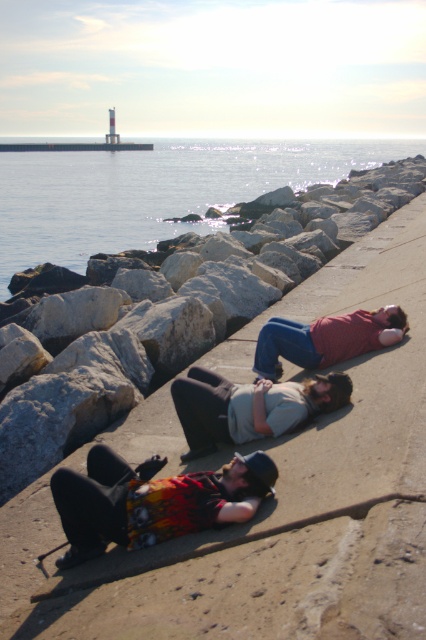
Question: Which object is the farthest from the printed cotton shirt at lower left?

Choices:
 (A) matte gray hoodie at center
 (B) clear water at center

Answer: (B)

Question: Can you confirm if matte gray hoodie at center is positioned above matte red shirt at center?

Choices:
 (A) no
 (B) yes

Answer: (A)

Question: Is printed cotton shirt at lower left below matte gray hoodie at center?

Choices:
 (A) yes
 (B) no

Answer: (A)

Question: Where is matte gray hoodie at center located in relation to matte red shirt at center in the image?

Choices:
 (A) left
 (B) right

Answer: (A)

Question: Considering the real-world distances, which object is farthest from the matte gray hoodie at center?

Choices:
 (A) clear water at center
 (B) printed cotton shirt at lower left
 (C) concrete at center

Answer: (A)

Question: Estimate the real-world distances between objects in this image. Which object is closer to the matte red shirt at center?

Choices:
 (A) concrete at center
 (B) printed cotton shirt at lower left
 (C) clear water at center
 (D) matte gray hoodie at center

Answer: (A)